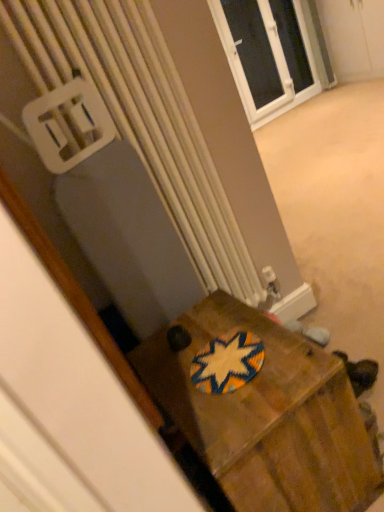
Identify the location of vacant area located to the right-hand side of woven fabric coaster at center. (283, 344).